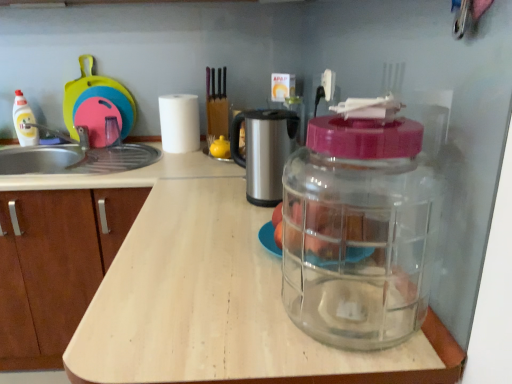
This screenshot has width=512, height=384. I want to click on vacant space in front of white matte paper towel at center, so click(170, 162).